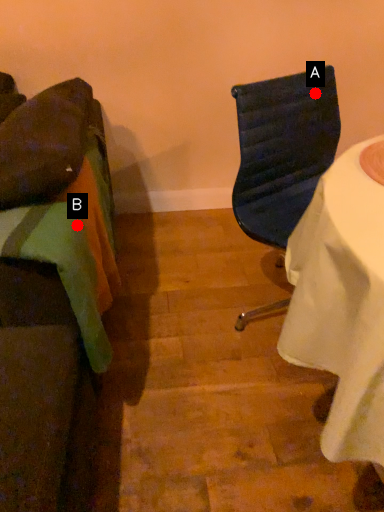
Question: Two points are circled on the image, labeled by A and B beside each circle. Which point is closer to the camera?

Choices:
 (A) A is closer
 (B) B is closer

Answer: (B)